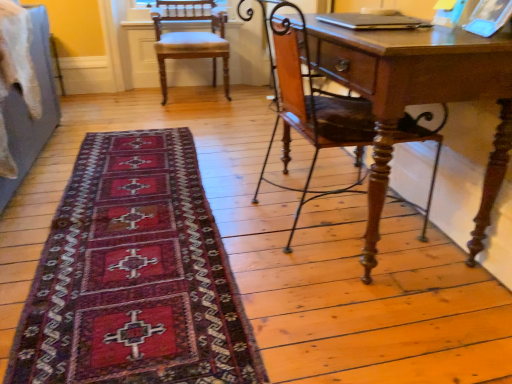
Question: Is wooden chair at right, the 2th chair viewed from the back, in front of or behind light brown wood chair at upper left, arranged as the 2th chair when viewed from the right, in the image?

Choices:
 (A) front
 (B) behind

Answer: (A)

Question: Considering the positions of wooden chair at right, positioned as the 1th chair in front-to-back order, and light brown wood chair at upper left, placed as the second chair when sorted from bottom to top, in the image, is wooden chair at right, positioned as the 1th chair in front-to-back order, bigger or smaller than light brown wood chair at upper left, placed as the second chair when sorted from bottom to top,?

Choices:
 (A) small
 (B) big

Answer: (B)

Question: Which of these objects is positioned farthest from the light brown wood chair at upper left, placed as the second chair when sorted from bottom to top?

Choices:
 (A) dark red woven rug at lower left
 (B) wooden chair at right, the 2th chair viewed from the back

Answer: (A)

Question: Which object is the closest to the light brown wood chair at upper left, which is the first chair from left to right?

Choices:
 (A) dark red woven rug at lower left
 (B) wooden chair at right, which is the second chair in top-to-bottom order

Answer: (B)